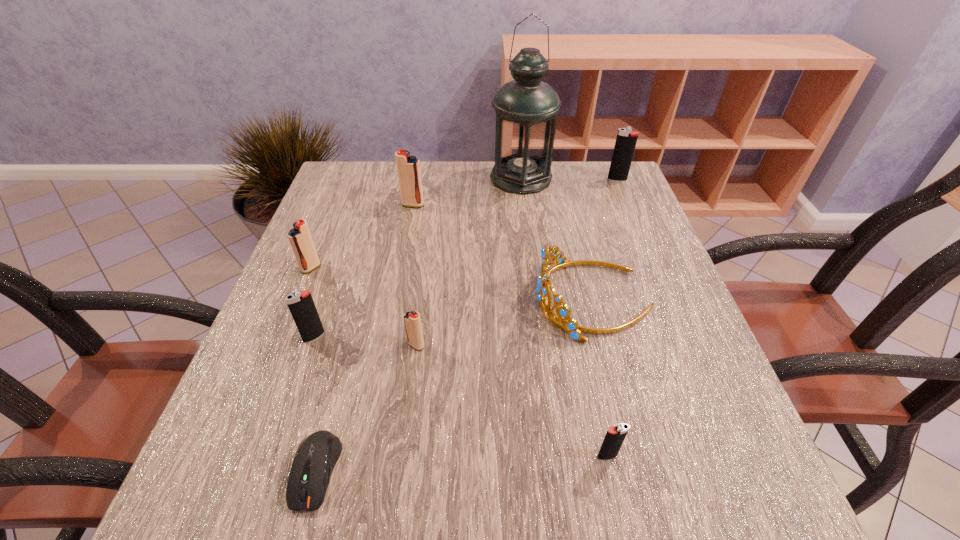
This screenshot has height=540, width=960. Find the location of `free space between the second farthest black igniter and the seventh object from right to left`. free space between the second farthest black igniter and the seventh object from right to left is located at coordinates (315, 404).

Select which object is the fourth closest to the second smallest black igniter. Please provide its 2D coordinates. Your answer should be formatted as a tuple, i.e. [(x, y)], where the tuple contains the x and y coordinates of a point satisfying the conditions above.

[(571, 326)]

Locate an element on the screen. object that is the seventh closest to the nearest igniter is located at coordinates (408, 167).

Locate an element on the screen. The width and height of the screenshot is (960, 540). igniter that stands as the fifth closest to the fifth object from right to left is located at coordinates (626, 139).

Locate an element on the screen. The width and height of the screenshot is (960, 540). igniter that is the second closest to the tallest object is located at coordinates (408, 167).

Select which red igniter is the closest to the rightmost black igniter. Please provide its 2D coordinates. Your answer should be formatted as a tuple, i.e. [(x, y)], where the tuple contains the x and y coordinates of a point satisfying the conditions above.

[(408, 167)]

Identify which red igniter is the second nearest to the fourth igniter from right to left. Please provide its 2D coordinates. Your answer should be formatted as a tuple, i.e. [(x, y)], where the tuple contains the x and y coordinates of a point satisfying the conditions above.

[(412, 320)]

Choose which black igniter is the nearest neighbor to the rightmost black igniter. Please provide its 2D coordinates. Your answer should be formatted as a tuple, i.e. [(x, y)], where the tuple contains the x and y coordinates of a point satisfying the conditions above.

[(614, 438)]

Identify the location of black igniter that stands as the second closest to the farthest igniter. (301, 305).